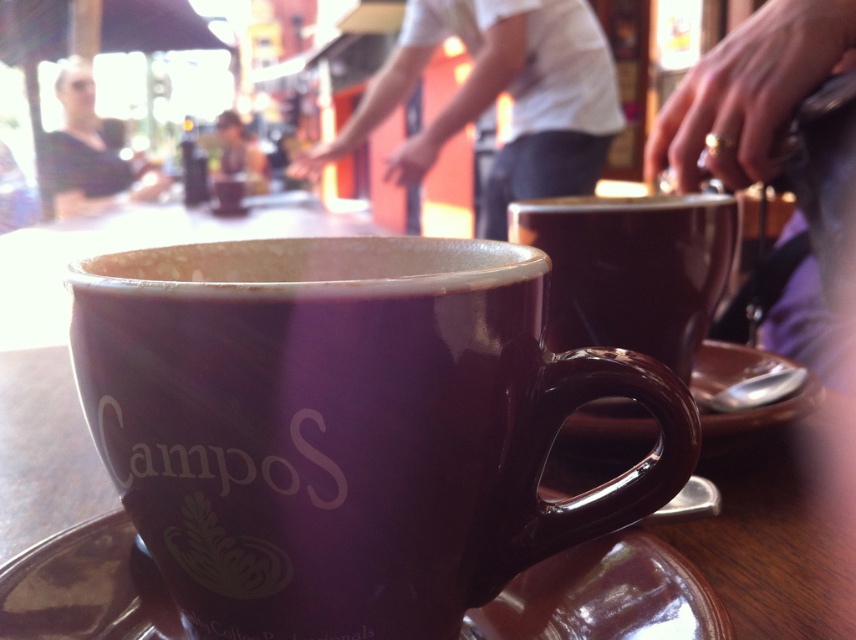
Is gold ring at upper right smaller than matte black shirt at upper left?

Indeed, gold ring at upper right has a smaller size compared to matte black shirt at upper left.

Can you confirm if gold ring at upper right is taller than matte black shirt at upper left?

No, gold ring at upper right is not taller than matte black shirt at upper left.

Is point (813, 61) positioned before point (119, 173)?

Yes.

You are a GUI agent. You are given a task and a screenshot of the screen. Output one action in this format:
    pyautogui.click(x=<x>, y=<y>)
    Task: Click on the gold ring at upper right
    This screenshot has height=640, width=856.
    Given the screenshot: What is the action you would take?
    pyautogui.click(x=750, y=90)

Is matte purple mug at center closer to camera compared to matte ceramic mug at center?

Yes, it is.

Is matte purple mug at center above matte ceramic mug at center?

Actually, matte purple mug at center is below matte ceramic mug at center.

Where is `matte purple mug at center`? matte purple mug at center is located at coordinates (348, 428).

Which is more to the right, matte purple mug at center or matte ceramic cup at center?

matte purple mug at center is more to the right.

At what (x,y) coordinates should I click in order to perform the action: click on matte purple mug at center. Please return your answer as a coordinate pair (x, y). Looking at the image, I should click on (348, 428).

Locate an element on the screen. The height and width of the screenshot is (640, 856). matte purple mug at center is located at coordinates (348, 428).